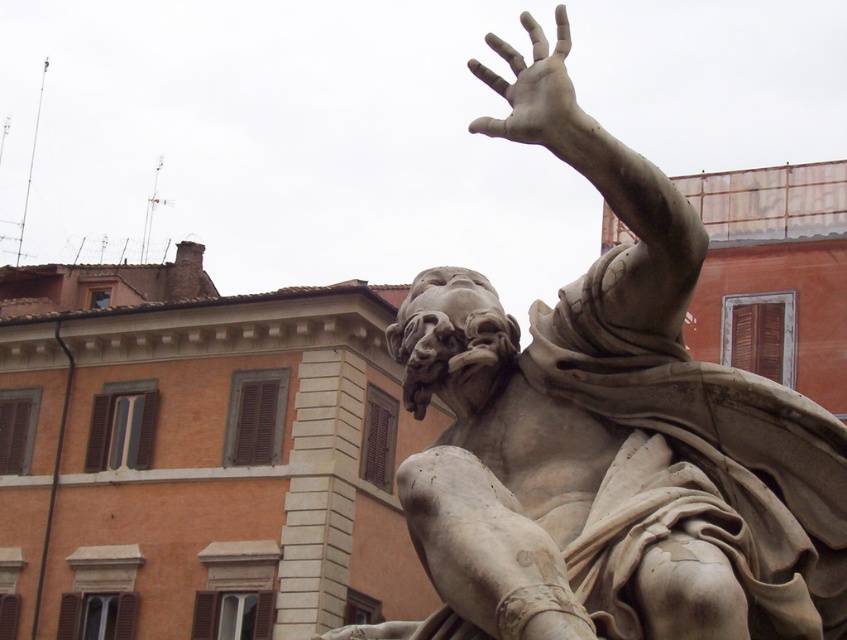
You are an art conservator examining the image. You notice the white marble statue at upper right and the smooth stone hand at upper right. Which object is smaller in size?

The white marble statue at upper right is smaller in size compared to the smooth stone hand at upper right.

You are an art conservator assessing the statue in the image. The white marble statue at upper right and the smooth stone hand at upper right are part of the same sculpture. Which part is narrower in width?

The white marble statue at upper right is narrower in width compared to the smooth stone hand at upper right.